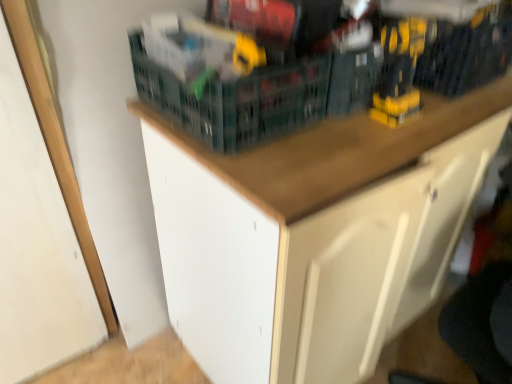
Question: Is green plastic basket at upper center thinner than yellow plastic drill at upper right, the 1th toy viewed from the right?

Choices:
 (A) yes
 (B) no

Answer: (B)

Question: From the image's perspective, is green plastic basket at upper center located beneath yellow plastic drill at upper right, the 1th toy viewed from the right?

Choices:
 (A) no
 (B) yes

Answer: (B)

Question: Is green plastic basket at upper center at the left side of yellow plastic drill at upper right, positioned as the second toy in left-to-right order?

Choices:
 (A) no
 (B) yes

Answer: (B)

Question: Can yellow plastic drill at upper right, positioned as the second toy in left-to-right order, be found inside green plastic basket at upper center?

Choices:
 (A) yes
 (B) no

Answer: (B)

Question: From a real-world perspective, is green plastic basket at upper center located higher than yellow plastic drill at upper right, the 1th toy viewed from the right?

Choices:
 (A) no
 (B) yes

Answer: (A)

Question: In the image, is green plastic basket at upper center on the left side or the right side of yellow plastic drill at upper right, positioned as the second toy in left-to-right order?

Choices:
 (A) right
 (B) left

Answer: (B)

Question: From a real-world perspective, is green plastic basket at upper center physically located above or below yellow plastic drill at upper right, positioned as the second toy in left-to-right order?

Choices:
 (A) above
 (B) below

Answer: (B)

Question: Considering the positions of point (281, 82) and point (395, 19), is point (281, 82) closer or farther from the camera than point (395, 19)?

Choices:
 (A) farther
 (B) closer

Answer: (A)

Question: From the image's perspective, is green plastic basket at upper center positioned above or below yellow plastic drill at upper right, positioned as the second toy in left-to-right order?

Choices:
 (A) below
 (B) above

Answer: (A)

Question: Which is correct: white matte drawer at lower right is inside wooden cabinet at upper center, or outside of it?

Choices:
 (A) outside
 (B) inside

Answer: (A)

Question: In the image, is white matte drawer at lower right positioned in front of or behind wooden cabinet at upper center?

Choices:
 (A) front
 (B) behind

Answer: (A)

Question: Looking at their shapes, would you say white matte drawer at lower right is wider or thinner than wooden cabinet at upper center?

Choices:
 (A) thin
 (B) wide

Answer: (B)

Question: Would you say white matte drawer at lower right is to the left or to the right of wooden cabinet at upper center in the picture?

Choices:
 (A) left
 (B) right

Answer: (B)

Question: From the image's perspective, is yellow plastic drill at upper right, the 1th toy viewed from the right, located above or below yellow plastic drill at upper center, the second toy positioned from the right?

Choices:
 (A) below
 (B) above

Answer: (A)

Question: Considering the positions of yellow plastic drill at upper right, positioned as the second toy in left-to-right order, and yellow plastic drill at upper center, placed as the first toy when sorted from left to right, in the image, is yellow plastic drill at upper right, positioned as the second toy in left-to-right order, taller or shorter than yellow plastic drill at upper center, placed as the first toy when sorted from left to right,?

Choices:
 (A) short
 (B) tall

Answer: (B)